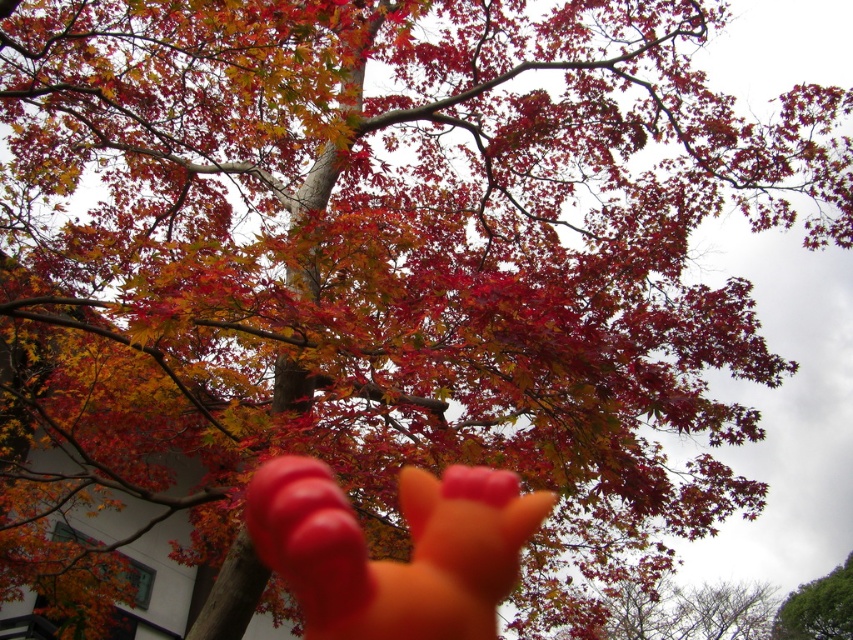
Between point (410, 481) and point (839, 592), which one is positioned behind?

The point (839, 592) is more distant.

Is orange matte hand at lower center to the right of green leafy tree at lower right from the viewer's perspective?

No, orange matte hand at lower center is not to the right of green leafy tree at lower right.

Between point (485, 618) and point (805, 632), which one is positioned behind?

The point (805, 632) is behind.

The image size is (853, 640). Find the location of `orange matte hand at lower center`. orange matte hand at lower center is located at coordinates (393, 561).